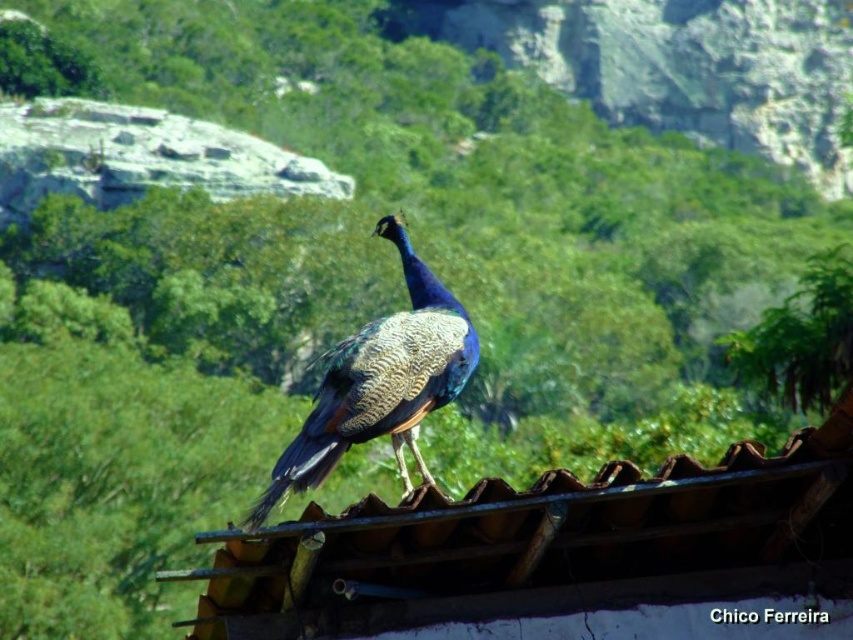
Does brown corrugated tile roof at center have a greater height compared to shiny blue peacock at center?

Correct, brown corrugated tile roof at center is much taller as shiny blue peacock at center.

Does brown corrugated tile roof at center appear under shiny blue peacock at center?

Yes, brown corrugated tile roof at center is below shiny blue peacock at center.

Identify the location of brown corrugated tile roof at center. [560, 556].